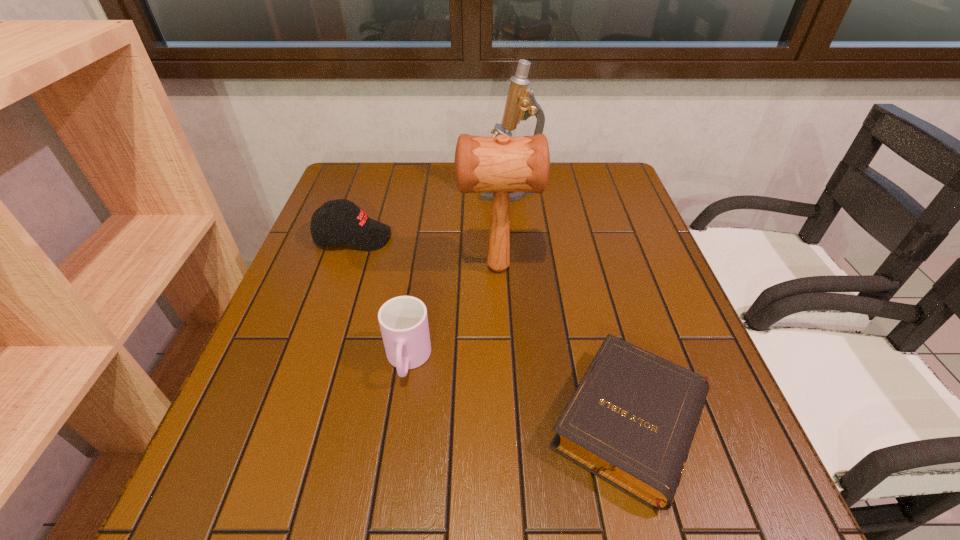
This screenshot has height=540, width=960. I want to click on free space located on the front-facing side of the baseball cap, so click(535, 237).

Locate an element on the screen. This screenshot has height=540, width=960. free space located 0.300m on the left of the Bible is located at coordinates (377, 423).

In order to click on object that is at the far edge in this screenshot , I will do `click(521, 104)`.

Where is `object located in the near edge section of the desktop`? This screenshot has width=960, height=540. object located in the near edge section of the desktop is located at coordinates (631, 421).

You are a GUI agent. You are given a task and a screenshot of the screen. Output one action in this format:
    pyautogui.click(x=<x>, y=<y>)
    Task: Click on the object at the left edge
    This screenshot has height=540, width=960.
    Given the screenshot: What is the action you would take?
    pyautogui.click(x=338, y=221)

Image resolution: width=960 pixels, height=540 pixels. I want to click on object that is at the right edge, so [631, 421].

Find the location of a particular element. object at the near right corner is located at coordinates (631, 421).

Where is `vacant space at the far edge of the desktop`? The width and height of the screenshot is (960, 540). vacant space at the far edge of the desktop is located at coordinates (566, 185).

Locate an element on the screen. vacant space at the near edge of the desktop is located at coordinates (364, 526).

Find the location of a particular element. Image resolution: width=960 pixels, height=540 pixels. free space at the left edge of the desktop is located at coordinates (327, 295).